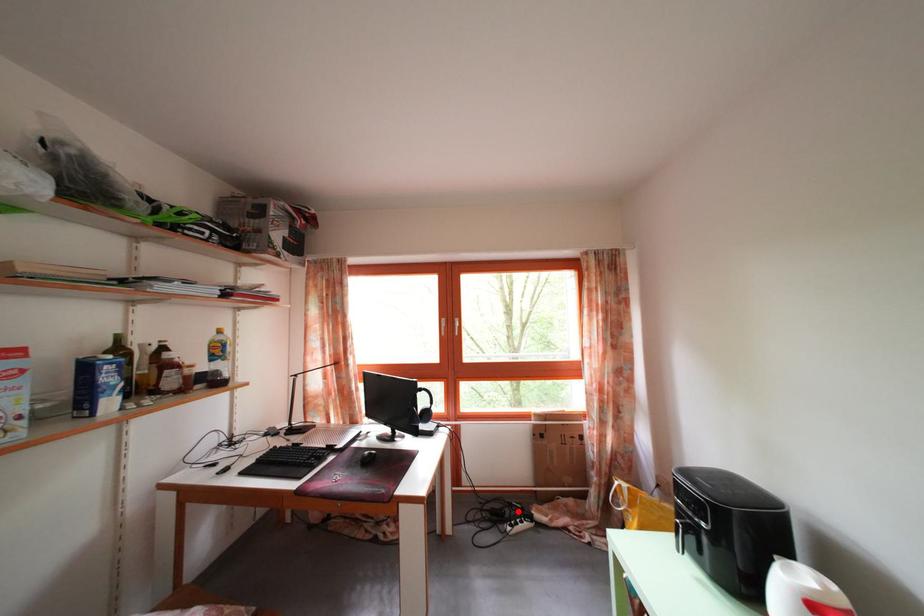
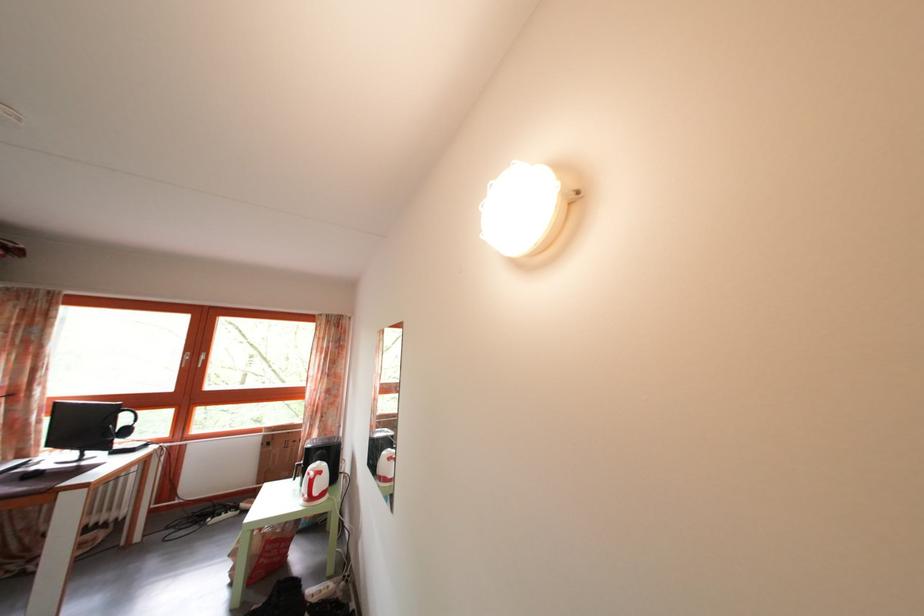
The point at the highlighted location is marked in the first image. Where is the corresponding point in the second image?

(233, 514)